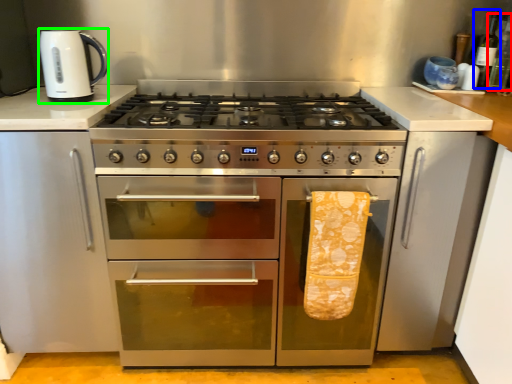
Question: Which object is positioned closest to bottle (highlighted by a red box)? Select from bottle (highlighted by a blue box) and kitchen appliance (highlighted by a green box).

Choices:
 (A) bottle
 (B) kitchen appliance

Answer: (A)